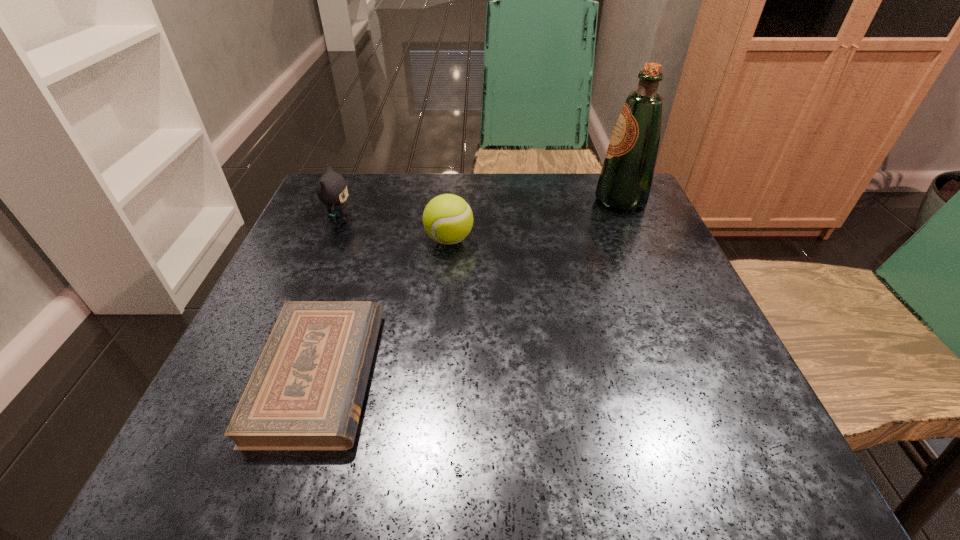
Find the location of `olive oil`. olive oil is located at coordinates (626, 177).

The image size is (960, 540). I want to click on the tallest object, so click(626, 177).

The height and width of the screenshot is (540, 960). Find the location of `kitten`. kitten is located at coordinates (332, 190).

I want to click on tennis ball, so click(x=447, y=219).

The image size is (960, 540). I want to click on Bible, so pos(306,392).

The width and height of the screenshot is (960, 540). I want to click on the shortest object, so click(306, 392).

Where is `free spot located 0.260m on the front-facing side of the olive oil`? Image resolution: width=960 pixels, height=540 pixels. free spot located 0.260m on the front-facing side of the olive oil is located at coordinates (482, 200).

You are a GUI agent. You are given a task and a screenshot of the screen. Output one action in this format:
    pyautogui.click(x=<x>, y=<y>)
    Task: Click on the blank space located on the front-facing side of the olive oil
    This screenshot has width=960, height=540.
    Given the screenshot: What is the action you would take?
    pyautogui.click(x=439, y=200)

Identify the location of free space located on the front-facing side of the olive oil. This screenshot has width=960, height=540. (x=425, y=200).

The width and height of the screenshot is (960, 540). Identify the location of blank space located on the front-facing side of the kitten. (523, 218).